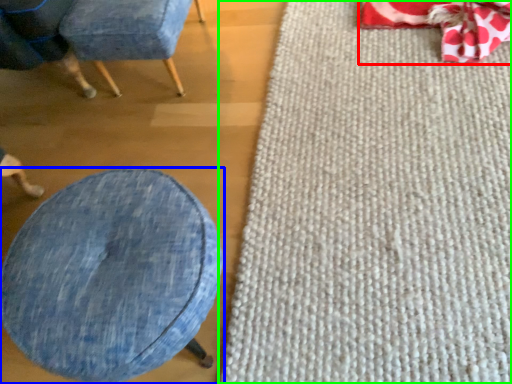
Question: Estimate the real-world distances between objects in this image. Which object is farther from bean bag chair (highlighted by a red box), furniture (highlighted by a blue box) or mat (highlighted by a green box)?

Choices:
 (A) furniture
 (B) mat

Answer: (A)